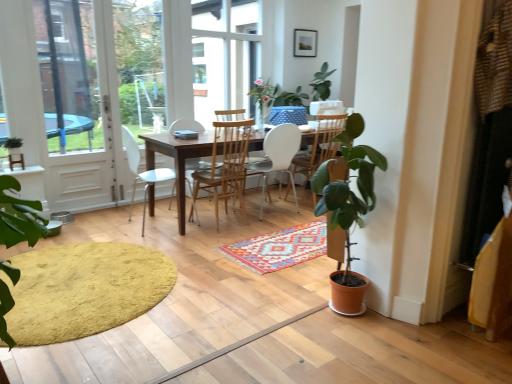
Where is `free space to the left of multicolored woven rug at center, the 2th doormat when ordered from left to right`? The height and width of the screenshot is (384, 512). free space to the left of multicolored woven rug at center, the 2th doormat when ordered from left to right is located at coordinates (205, 235).